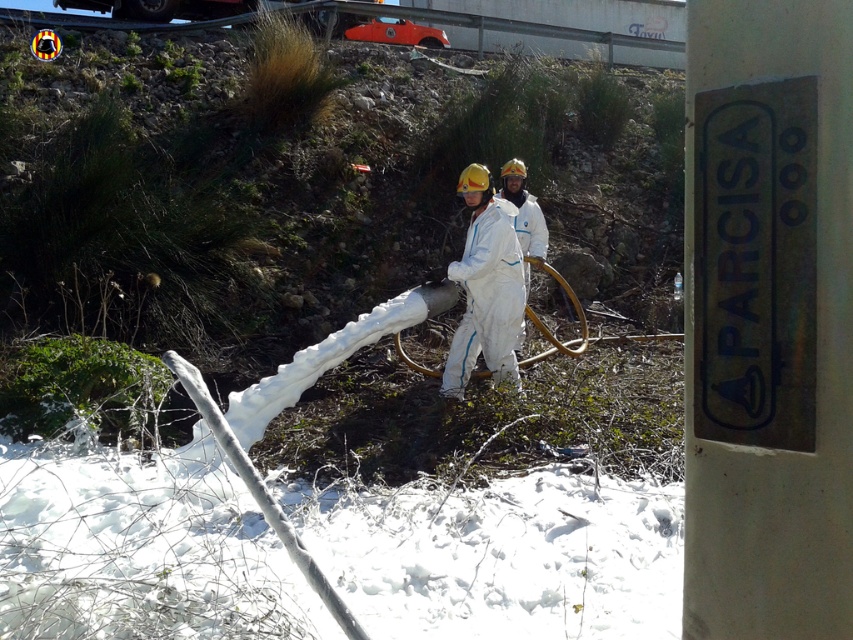
You are a safety inspector assessing the hazardous material handling site. You notice the white metal sign at right and the white matte suit at center. Which object is located lower in the scene?

The white metal sign at right is positioned under the white matte suit at center, meaning it is lower in the scene.

You are a safety inspector assessing the hazardous material handling site. You notice the white metal sign at right and the white matte suit at center. Which object takes up more area in the image?

The white matte suit at center occupies more space than the white metal sign at right.